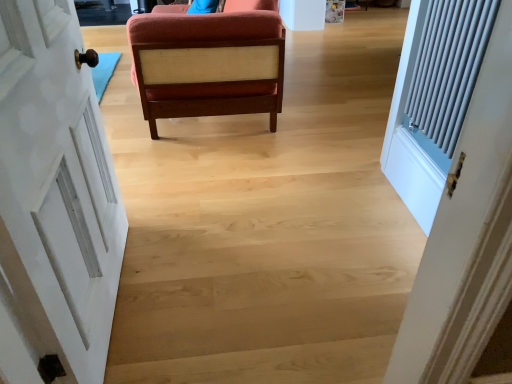
The image size is (512, 384). What do you see at coordinates (208, 64) in the screenshot?
I see `velvet orange chair at center` at bounding box center [208, 64].

Locate an element on the screen. This screenshot has width=512, height=384. velvet orange chair at center is located at coordinates (208, 64).

The image size is (512, 384). Describe the element at coordinates (54, 201) in the screenshot. I see `white painted wood door at left` at that location.

Where is `white painted wood door at left`? The height and width of the screenshot is (384, 512). white painted wood door at left is located at coordinates (54, 201).

Identify the location of velvet orange chair at center. This screenshot has width=512, height=384. (208, 64).

Considering the positions of objects velvet orange chair at center and white painted wood door at left in the image provided, who is more to the right, velvet orange chair at center or white painted wood door at left?

velvet orange chair at center is more to the right.

Between velvet orange chair at center and white painted wood door at left, which one is positioned behind?

Positioned behind is velvet orange chair at center.

Is point (170, 79) behind point (14, 363)?

Yes.

From the image's perspective, is velvet orange chair at center above or below white painted wood door at left?

velvet orange chair at center is above white painted wood door at left.

From a real-world perspective, is velvet orange chair at center on top of white painted wood door at left?

No, from a real-world perspective, velvet orange chair at center is not on top of white painted wood door at left.

In terms of width, does velvet orange chair at center look wider or thinner when compared to white painted wood door at left?

In the image, velvet orange chair at center appears to be wider than white painted wood door at left.

Does velvet orange chair at center have a lesser height compared to white painted wood door at left?

Yes, velvet orange chair at center is shorter than white painted wood door at left.

Looking at the image, does velvet orange chair at center seem bigger or smaller compared to white painted wood door at left?

velvet orange chair at center is bigger than white painted wood door at left.

Is white painted wood door at left a part of velvet orange chair at center?

No.

Does velvet orange chair at center touch white painted wood door at left?

velvet orange chair at center and white painted wood door at left are clearly separated.

Could you tell me if velvet orange chair at center is turned towards white painted wood door at left?

No, velvet orange chair at center does not turn towards white painted wood door at left.

I want to click on chair directly beneath the white painted wood door at left (from a real-world perspective), so click(x=208, y=64).

Visually, is white painted wood door at left positioned to the left or to the right of velvet orange chair at center?

white painted wood door at left is positioned on velvet orange chair at center's left side.

From the picture: Which object is further away from the camera, white painted wood door at left or velvet orange chair at center?

velvet orange chair at center is further from the camera.

Which point is more forward, (x=47, y=322) or (x=161, y=86)?

The point (x=47, y=322) is more forward.

From the image's perspective, relative to velvet orange chair at center, is white painted wood door at left above or below?

Based on their image positions, white painted wood door at left is located beneath velvet orange chair at center.

From a real-world perspective, who is located lower, white painted wood door at left or velvet orange chair at center?

velvet orange chair at center.

From the picture: Considering the relative sizes of white painted wood door at left and velvet orange chair at center in the image provided, is white painted wood door at left wider than velvet orange chair at center?

No.

From the picture: Who is taller, white painted wood door at left or velvet orange chair at center?

Standing taller between the two is white painted wood door at left.

Can you confirm if white painted wood door at left is smaller than velvet orange chair at center?

Yes, white painted wood door at left is smaller than velvet orange chair at center.

Is white painted wood door at left outside of velvet orange chair at center?

Yes, white painted wood door at left is outside of velvet orange chair at center.

Are white painted wood door at left and velvet orange chair at center located far from each other?

Actually, white painted wood door at left and velvet orange chair at center are a little close together.

Is white painted wood door at left aimed at velvet orange chair at center?

No, white painted wood door at left is not oriented towards velvet orange chair at center.

How far apart are white painted wood door at left and velvet orange chair at center?

white painted wood door at left is 93.80 centimeters away from velvet orange chair at center.

At what (x,y) coordinates should I click in order to perform the action: click on chair on the right of the white painted wood door at left. Please return your answer as a coordinate pair (x, y). The width and height of the screenshot is (512, 384). Looking at the image, I should click on (208, 64).

Locate an element on the screen. This screenshot has width=512, height=384. door above the velvet orange chair at center (from a real-world perspective) is located at coordinates (54, 201).

Find the location of a particular element. door that is on the left side of velvet orange chair at center is located at coordinates (54, 201).